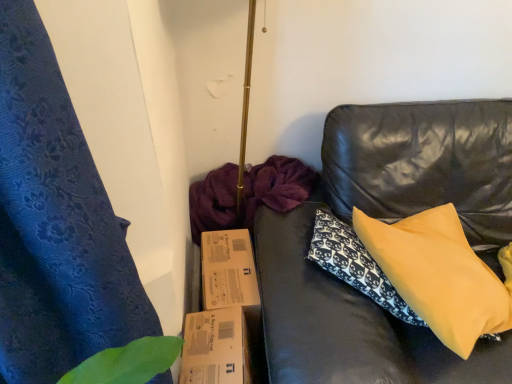
Describe the element at coordinates (225, 315) in the screenshot. I see `brown cardboard box at lower center` at that location.

The height and width of the screenshot is (384, 512). Find the location of `brown cardboard box at lower center`. brown cardboard box at lower center is located at coordinates (225, 315).

This screenshot has width=512, height=384. Describe the element at coordinates (439, 275) in the screenshot. I see `yellow fabric pillow at right` at that location.

This screenshot has width=512, height=384. Identify the location of yellow fabric pillow at right. (439, 275).

The image size is (512, 384). Find the location of `brown cardboard box at lower center`. brown cardboard box at lower center is located at coordinates point(225,315).

Can you confirm if brown cardboard box at lower center is positioned to the left of yellow fabric pillow at right?

Yes, brown cardboard box at lower center is to the left of yellow fabric pillow at right.

Is brown cardboard box at lower center in front of yellow fabric pillow at right?

No, the depth of brown cardboard box at lower center is greater than that of yellow fabric pillow at right.

Considering the points (222, 300) and (457, 255), which point is in front, point (222, 300) or point (457, 255)?

Point (222, 300)

Looking at this image, from the image's perspective, which one is positioned lower, brown cardboard box at lower center or yellow fabric pillow at right?

brown cardboard box at lower center, from the image's perspective.

From a real-world perspective, is brown cardboard box at lower center above or below yellow fabric pillow at right?

In terms of real-world spatial position, brown cardboard box at lower center is below yellow fabric pillow at right.

In terms of width, does brown cardboard box at lower center look wider or thinner when compared to yellow fabric pillow at right?

brown cardboard box at lower center is wider than yellow fabric pillow at right.

Considering the sizes of brown cardboard box at lower center and yellow fabric pillow at right in the image, is brown cardboard box at lower center taller or shorter than yellow fabric pillow at right?

Clearly, brown cardboard box at lower center is taller compared to yellow fabric pillow at right.

Is brown cardboard box at lower center bigger or smaller than yellow fabric pillow at right?

In the image, brown cardboard box at lower center appears to be larger than yellow fabric pillow at right.

Can we say brown cardboard box at lower center lies outside yellow fabric pillow at right?

Yes, brown cardboard box at lower center is outside of yellow fabric pillow at right.

Is brown cardboard box at lower center positioned far away from yellow fabric pillow at right?

That's not correct — brown cardboard box at lower center is a little close to yellow fabric pillow at right.

Is yellow fabric pillow at right at the back of brown cardboard box at lower center?

brown cardboard box at lower center is not turned away from yellow fabric pillow at right.

The image size is (512, 384). What are the coordinates of `cardboard box located underneath the yellow fabric pillow at right (from a real-world perspective)` in the screenshot? It's located at (225, 315).

Considering the relative positions of yellow fabric pillow at right and brown cardboard box at lower center in the image provided, is yellow fabric pillow at right to the left or to the right of brown cardboard box at lower center?

yellow fabric pillow at right is positioned on brown cardboard box at lower center's right side.

Is the depth of yellow fabric pillow at right less than that of brown cardboard box at lower center?

Yes, it is in front of brown cardboard box at lower center.

Is point (473, 299) closer or farther from the camera than point (187, 369)?

Point (473, 299) is positioned farther from the camera compared to point (187, 369).

From the image's perspective, is yellow fabric pillow at right on top of brown cardboard box at lower center?

Yes, from the image's perspective, yellow fabric pillow at right is above brown cardboard box at lower center.

From a real-world perspective, who is located higher, yellow fabric pillow at right or brown cardboard box at lower center?

From a 3D spatial view, yellow fabric pillow at right is above.

Is yellow fabric pillow at right wider than brown cardboard box at lower center?

In fact, yellow fabric pillow at right might be narrower than brown cardboard box at lower center.

Looking at this image, in terms of height, does yellow fabric pillow at right look taller or shorter compared to brown cardboard box at lower center?

Clearly, yellow fabric pillow at right is shorter compared to brown cardboard box at lower center.

Is yellow fabric pillow at right bigger than brown cardboard box at lower center?

Incorrect, yellow fabric pillow at right is not larger than brown cardboard box at lower center.

Is yellow fabric pillow at right not within brown cardboard box at lower center?

That's correct, yellow fabric pillow at right is outside of brown cardboard box at lower center.

Is the surface of yellow fabric pillow at right in direct contact with brown cardboard box at lower center?

yellow fabric pillow at right and brown cardboard box at lower center are clearly separated.

Is brown cardboard box at lower center at the back of yellow fabric pillow at right?

yellow fabric pillow at right is not turned away from brown cardboard box at lower center.

You are a GUI agent. You are given a task and a screenshot of the screen. Output one action in this format:
    pyautogui.click(x=<x>, y=<y>)
    Task: Click on the pillow lying above the brown cardboard box at lower center (from the image's perspective)
    This screenshot has width=512, height=384.
    Given the screenshot: What is the action you would take?
    pyautogui.click(x=439, y=275)

Find the location of `pillow on the right side of brown cardboard box at lower center`. pillow on the right side of brown cardboard box at lower center is located at coordinates (439, 275).

In order to click on pillow in front of the brown cardboard box at lower center in this screenshot , I will do `click(439, 275)`.